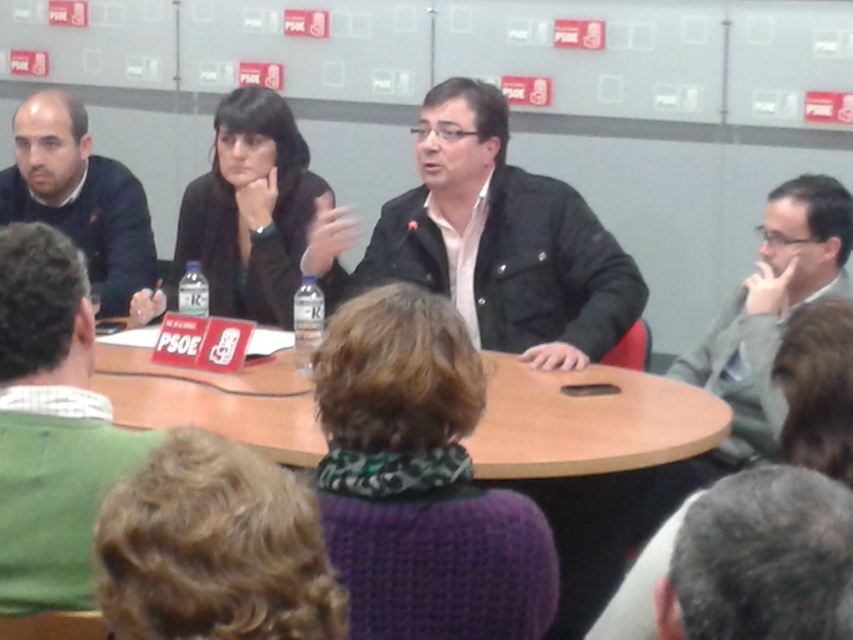
Question: Which object appears closest to the camera in this image?

Choices:
 (A) matte black jacket at left
 (B) matte black jacket at center
 (C) gray fabric suit at right
 (D) green sweater at lower left

Answer: (D)

Question: Does wooden table at center appear on the right side of gray fabric suit at right?

Choices:
 (A) no
 (B) yes

Answer: (A)

Question: Does matte black jacket at center appear under gray fabric suit at right?

Choices:
 (A) no
 (B) yes

Answer: (A)

Question: Which point is farther to the camera?

Choices:
 (A) (770, 234)
 (B) (90, 589)
 (C) (367, 248)

Answer: (C)

Question: Can you confirm if wooden table at center is smaller than matte black jacket at left?

Choices:
 (A) no
 (B) yes

Answer: (B)

Question: Which object is positioned farthest from the matte black jacket at left?

Choices:
 (A) green sweater at lower left
 (B) matte black jacket at center
 (C) wooden table at center

Answer: (A)